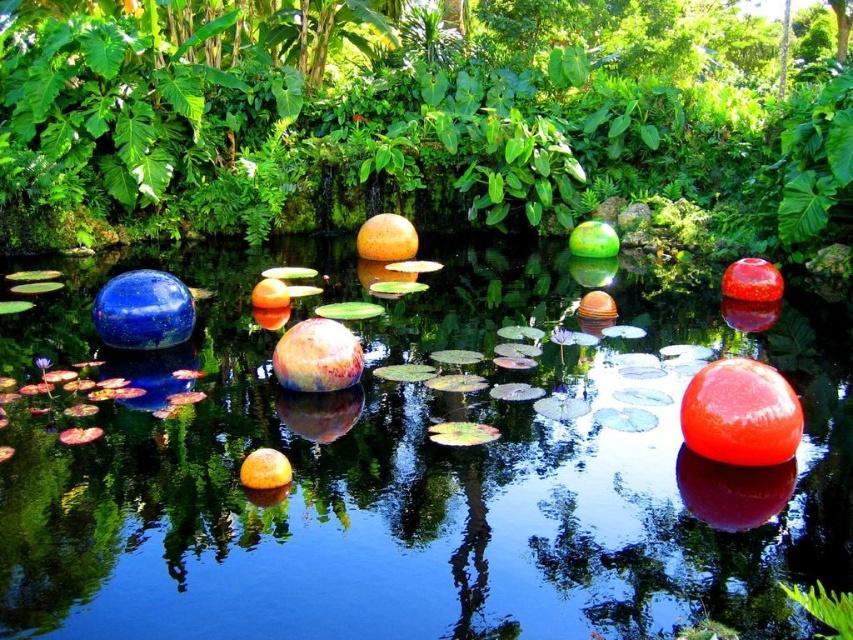
You are standing at the edge of the pond and want to place a decorative statue exactly at the center of the transparent glass water at center. According to the coordinates provided, what are the coordinates where you should place the statue?

The coordinates for the transparent glass water at center are at point (416,472), so you should place the statue at those coordinates.

You are standing at the edge of the pond and want to take a photo of both the transparent glass water at center and the green leafy tree at center. Which object will appear larger in your photo?

The transparent glass water at center will appear larger in the photo because it is closer to the viewer than the green leafy tree at center, making it appear bigger in the image.